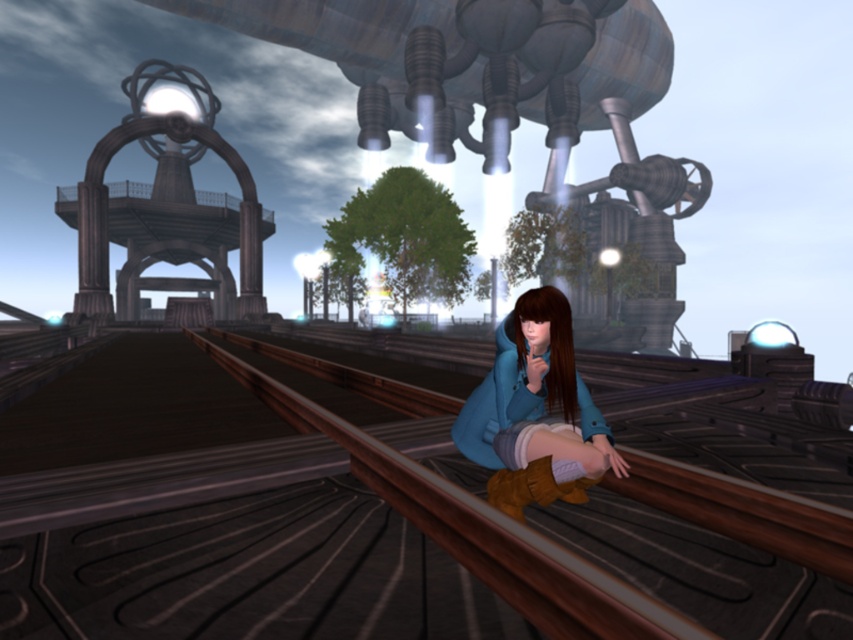
Question: Which of the following is the closest to the observer?

Choices:
 (A) blue suede boots at lower center
 (B) brown leather boot at lower center
 (C) brown wooden train track at center

Answer: (A)

Question: Among these points, which one is nearest to the camera?

Choices:
 (A) (666, 552)
 (B) (492, 496)

Answer: (A)

Question: Does brown wooden train track at center come behind blue suede boots at lower center?

Choices:
 (A) no
 (B) yes

Answer: (B)

Question: Does brown wooden train track at center lie behind brown leather boot at lower center?

Choices:
 (A) no
 (B) yes

Answer: (B)

Question: Which is farther from the brown leather boot at lower center?

Choices:
 (A) blue suede boots at lower center
 (B) brown wooden train track at center

Answer: (B)

Question: Considering the relative positions of brown wooden train track at center and brown leather boot at lower center in the image provided, where is brown wooden train track at center located with respect to brown leather boot at lower center?

Choices:
 (A) above
 (B) below

Answer: (B)